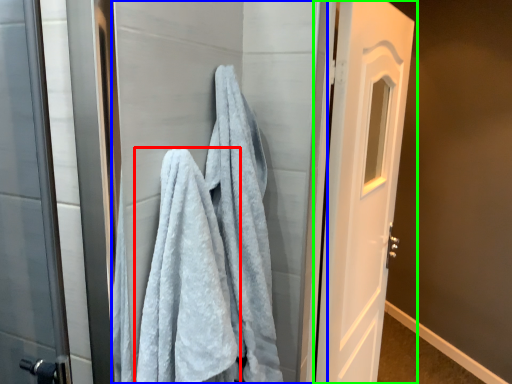
Question: Considering the real-world distances, which object is closest to towel (highlighted by a red box)? screen door (highlighted by a blue box) or door (highlighted by a green box).

Choices:
 (A) screen door
 (B) door

Answer: (A)